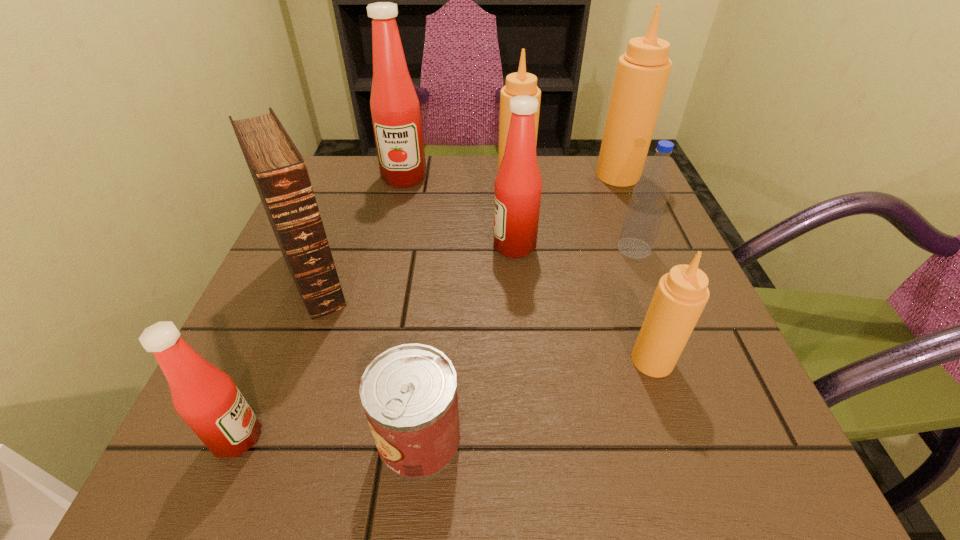
In order to click on red condiment that is the second closest one to the leftmost condiment in this screenshot , I will do `click(395, 109)`.

Locate which red condiment is the second closest to the biggest tan condiment. Please provide its 2D coordinates. Your answer should be formatted as a tuple, i.e. [(x, y)], where the tuple contains the x and y coordinates of a point satisfying the conditions above.

[(395, 109)]

I want to click on vacant space that satisfies the following two spatial constraints: 1. on the front side of the leftmost tan condiment; 2. on the right side of the blue water bottle, so click(x=522, y=249).

I want to click on free point that satisfies the following two spatial constraints: 1. on the front-facing side of the blue water bottle; 2. on the right side of the second biggest red condiment, so click(515, 249).

Find the location of a particular element. vacant position in the image that satisfies the following two spatial constraints: 1. on the back side of the can; 2. on the right side of the water bottle is located at coordinates (439, 249).

You are a GUI agent. You are given a task and a screenshot of the screen. Output one action in this format:
    pyautogui.click(x=<x>, y=<y>)
    Task: Click on the vacant region that satisfies the following two spatial constraints: 1. on the front-facing side of the fourth farthest condiment; 2. on the right side of the fifth farthest condiment
    This screenshot has width=960, height=540.
    Given the screenshot: What is the action you would take?
    pyautogui.click(x=524, y=360)

Find the location of `free space that satisfies the following two spatial constraints: 1. on the front-facing side of the fourth farthest condiment; 2. on the right side of the blue water bottle`. free space that satisfies the following two spatial constraints: 1. on the front-facing side of the fourth farthest condiment; 2. on the right side of the blue water bottle is located at coordinates (515, 249).

This screenshot has width=960, height=540. I want to click on vacant space that satisfies the following two spatial constraints: 1. on the back side of the shortest object; 2. on the left side of the water bottle, so pyautogui.click(x=439, y=249).

The image size is (960, 540). I want to click on vacant space that satisfies the following two spatial constraints: 1. on the front-facing side of the leftmost tan condiment; 2. on the left side of the farthest red condiment, so coord(404,180).

Locate an element on the screen. This screenshot has height=540, width=960. free space that satisfies the following two spatial constraints: 1. on the front side of the second biggest tan condiment; 2. on the front-facing side of the rightmost red condiment is located at coordinates pos(522,246).